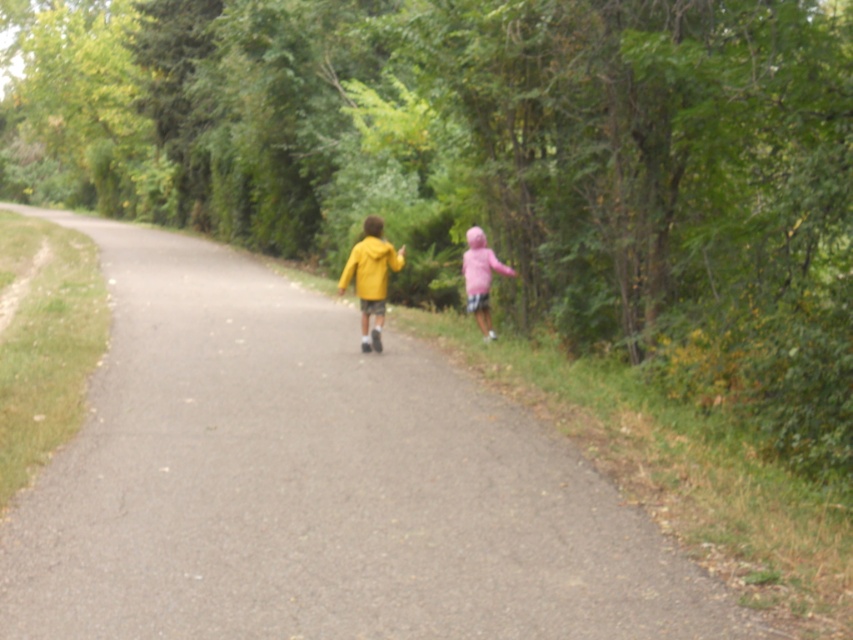
You are a pedestrian trying to cross the path. You see the asphalt road at center and the matte yellow jacket at center. Which object is closer to your left side?

The asphalt road at center is positioned on the left side of matte yellow jacket at center, so the asphalt road at center is closer to your left side.

You are a photographer standing at the starting point of the path. You want to take a photo of the matte yellow jacket at center so that it appears large and clear in the image. Considering the distance, would you need to use a zoom lens to capture it effectively?

The matte yellow jacket at center is 12.92 meters away from the camera. To make it appear large and clear in the photo, you would need to use a zoom lens to magnify the subject from that distance.

You are standing at the starting point of the path and want to reach the point marked as point (175, 368) and point (360, 241). Which point should you head towards first if you want to reach the one closer to you?

You should head towards point (175, 368) first because it is closer to you than point (360, 241).